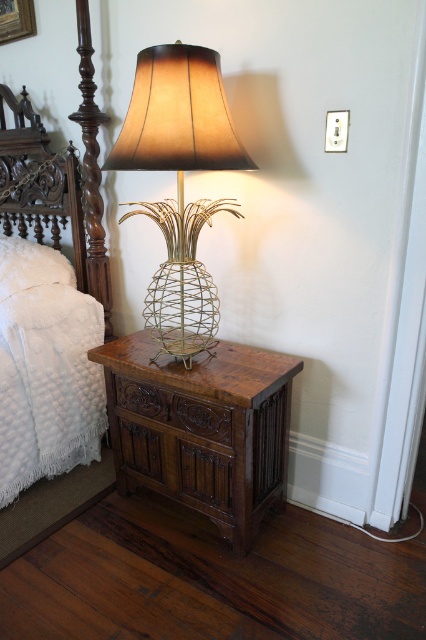
Question: Which point is farther to the camera?

Choices:
 (A) white fluffy pillow at upper left
 (B) gold wire pineapple lamp at center
 (C) white quilted fabric at left
 (D) brown carved wood drawer at lower center

Answer: (A)

Question: Is brown wood side table at lower center closer to the viewer compared to gold wire pineapple lamp at center?

Choices:
 (A) yes
 (B) no

Answer: (B)

Question: Which point is closer to the camera taking this photo?

Choices:
 (A) (141, 472)
 (B) (186, 424)
 (C) (192, 321)

Answer: (B)

Question: Does white quilted fabric at left have a larger size compared to gold wire pineapple lamp at center?

Choices:
 (A) yes
 (B) no

Answer: (A)

Question: Can you confirm if brown carved wood drawer at lower center is positioned below white fluffy pillow at upper left?

Choices:
 (A) yes
 (B) no

Answer: (A)

Question: Which point is closer to the camera?

Choices:
 (A) (40, 268)
 (B) (14, 237)

Answer: (A)